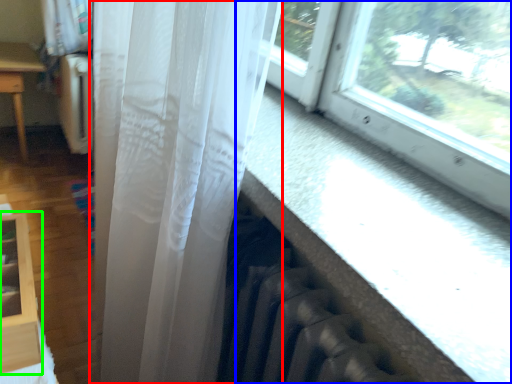
Question: Estimate the real-world distances between objects in this image. Which object is closer to curtain (highlighted by a red box), window (highlighted by a blue box) or shelf (highlighted by a green box)?

Choices:
 (A) window
 (B) shelf

Answer: (A)